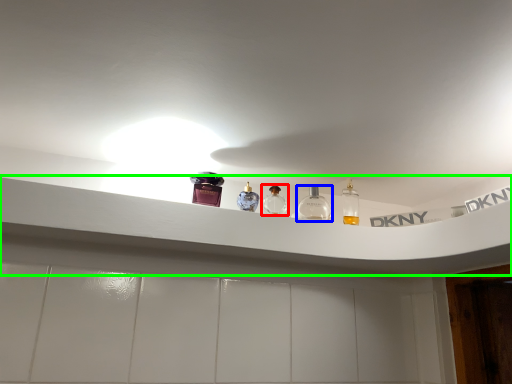
Question: Considering the real-world distances, which object is farthest from bottle (highlighted by a red box)? bottle (highlighted by a blue box) or window sill (highlighted by a green box)?

Choices:
 (A) bottle
 (B) window sill

Answer: (B)